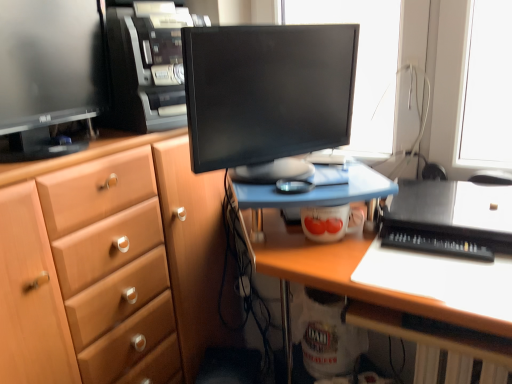
Question: Does black plastic computer tower at upper center have a lesser height compared to black glossy monitor at center, the second computer monitor from the left?

Choices:
 (A) no
 (B) yes

Answer: (B)

Question: From a real-world perspective, is black plastic computer tower at upper center positioned under black glossy monitor at center, which is the first computer monitor in right-to-left order, based on gravity?

Choices:
 (A) yes
 (B) no

Answer: (B)

Question: Could black glossy monitor at center, the second computer monitor from the left, be considered to be inside black plastic computer tower at upper center?

Choices:
 (A) yes
 (B) no

Answer: (B)

Question: Considering the relative sizes of black plastic computer tower at upper center and black glossy monitor at center, the second computer monitor from the left, in the image provided, is black plastic computer tower at upper center thinner than black glossy monitor at center, the second computer monitor from the left,?

Choices:
 (A) yes
 (B) no

Answer: (B)

Question: Is black plastic computer tower at upper center positioned before black glossy monitor at center, which is the first computer monitor in right-to-left order?

Choices:
 (A) yes
 (B) no

Answer: (B)

Question: Considering the relative sizes of black plastic computer tower at upper center and black glossy monitor at center, which is the first computer monitor in right-to-left order, in the image provided, is black plastic computer tower at upper center bigger than black glossy monitor at center, which is the first computer monitor in right-to-left order,?

Choices:
 (A) yes
 (B) no

Answer: (B)

Question: Considering the relative sizes of matte black monitor at left, the 2th computer monitor from the right, and black glossy monitor at center, which is the first computer monitor in right-to-left order, in the image provided, is matte black monitor at left, the 2th computer monitor from the right, bigger than black glossy monitor at center, which is the first computer monitor in right-to-left order,?

Choices:
 (A) no
 (B) yes

Answer: (A)

Question: Is matte black monitor at left, the 2th computer monitor from the right, not within black glossy monitor at center, the second computer monitor from the left?

Choices:
 (A) yes
 (B) no

Answer: (A)

Question: Is matte black monitor at left, which is the first computer monitor from left to right, in contact with black glossy monitor at center, which is the first computer monitor in right-to-left order?

Choices:
 (A) no
 (B) yes

Answer: (A)

Question: Is black glossy monitor at center, which is the first computer monitor in right-to-left order, completely or partially inside matte black monitor at left, which is the first computer monitor from left to right?

Choices:
 (A) no
 (B) yes

Answer: (A)

Question: Can you confirm if matte black monitor at left, the 2th computer monitor from the right, is positioned to the right of black glossy monitor at center, the second computer monitor from the left?

Choices:
 (A) yes
 (B) no

Answer: (B)

Question: Is matte black monitor at left, which is the first computer monitor from left to right, further to the viewer compared to black glossy monitor at center, which is the first computer monitor in right-to-left order?

Choices:
 (A) yes
 (B) no

Answer: (B)

Question: Does black plastic computer tower at upper center have a larger size compared to matte black monitor at left, the 2th computer monitor from the right?

Choices:
 (A) no
 (B) yes

Answer: (A)